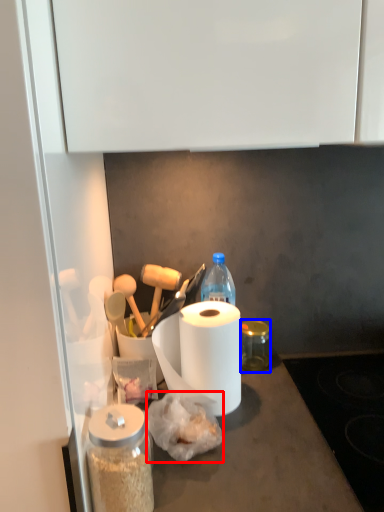
Question: Among these objects, which one is farthest to the camera, food (highlighted by a red box) or glass jar (highlighted by a blue box)?

Choices:
 (A) food
 (B) glass jar

Answer: (B)